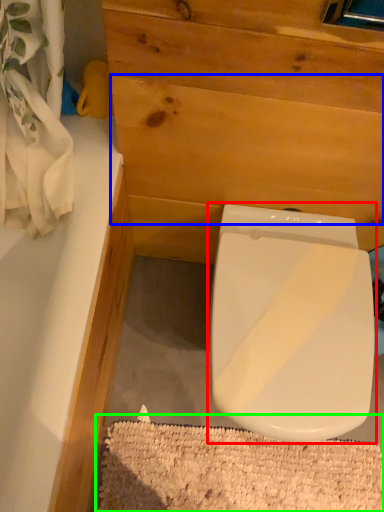
Question: Based on their relative distances, which object is nearer to toilet (highlighted by a red box)? Choose from plywood (highlighted by a blue box) and bath mat (highlighted by a green box).

Choices:
 (A) plywood
 (B) bath mat

Answer: (A)